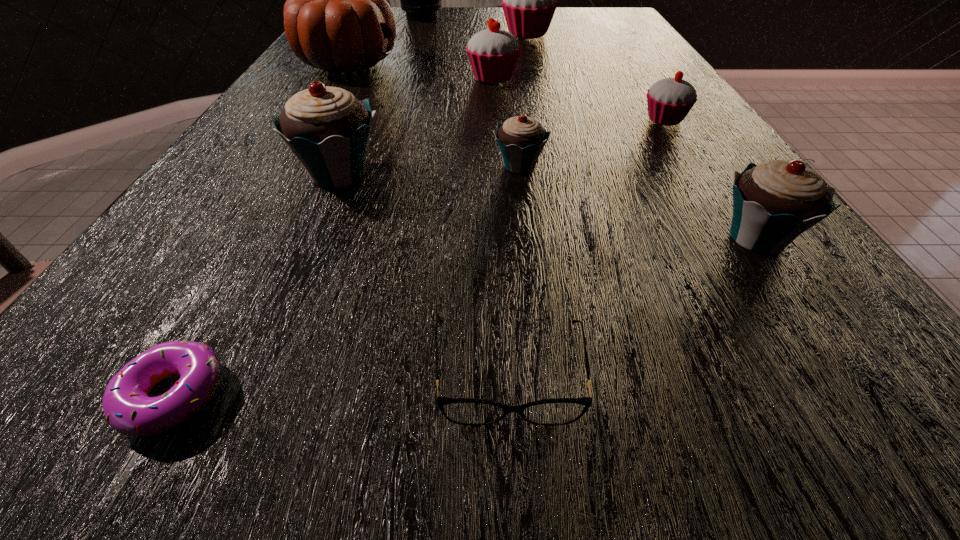
Locate an element on the screen. vacant area that satisfies the following two spatial constraints: 1. on the face of the doughnut; 2. on the left side of the orange pumpkin is located at coordinates (157, 395).

I want to click on vacant space that satisfies the following two spatial constraints: 1. on the front side of the farthest object; 2. on the face of the pumpkin, so click(407, 64).